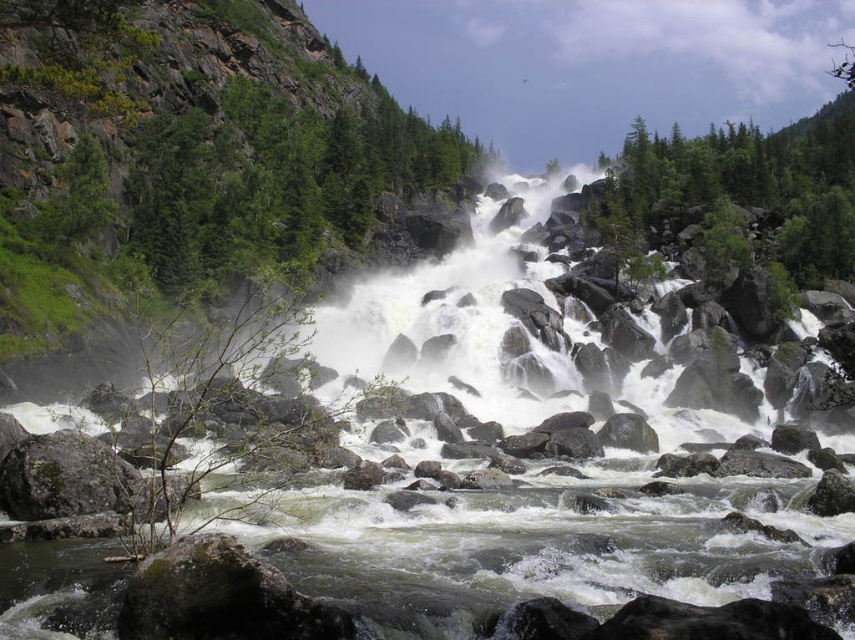
Does green leafy tree at left have a smaller size compared to green leafy tree at upper right?

Correct, green leafy tree at left occupies less space than green leafy tree at upper right.

Is green leafy tree at left to the right of green leafy tree at upper right from the viewer's perspective?

In fact, green leafy tree at left is to the left of green leafy tree at upper right.

This screenshot has width=855, height=640. In order to click on green leafy tree at left in this screenshot , I will do `click(193, 145)`.

The width and height of the screenshot is (855, 640). Identify the location of green leafy tree at left. (193, 145).